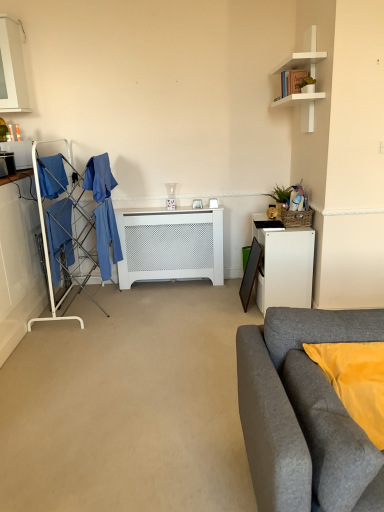
This screenshot has height=512, width=384. Find the location of `vacant space in front of white matte radiator at center`. vacant space in front of white matte radiator at center is located at coordinates (168, 308).